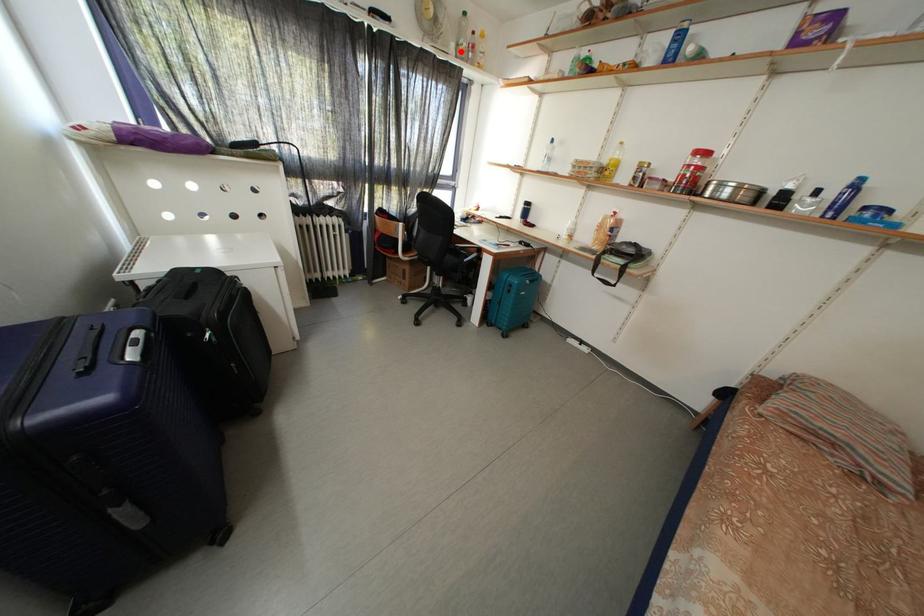
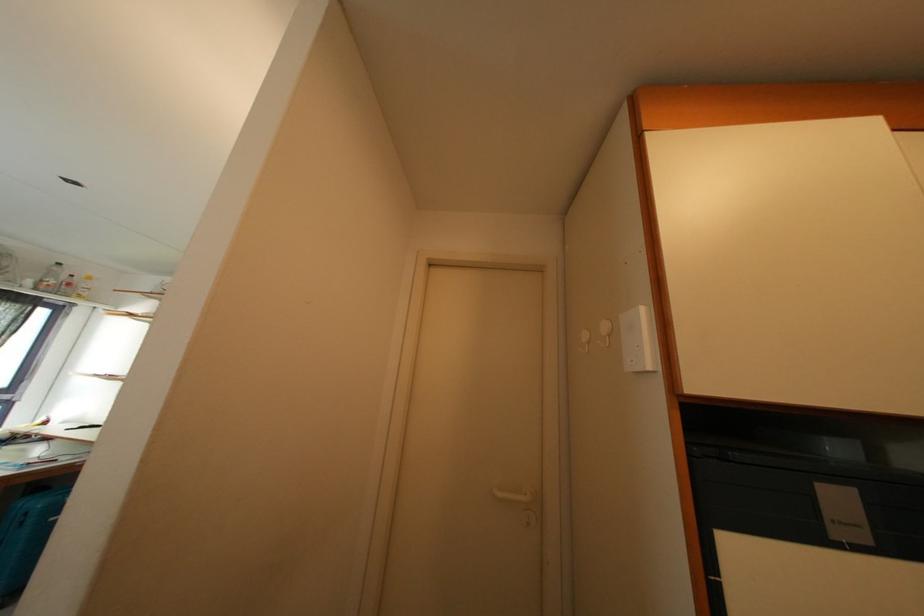
Locate, in the second image, the point that corresponds to the highlighted location in the first image.

(38, 286)